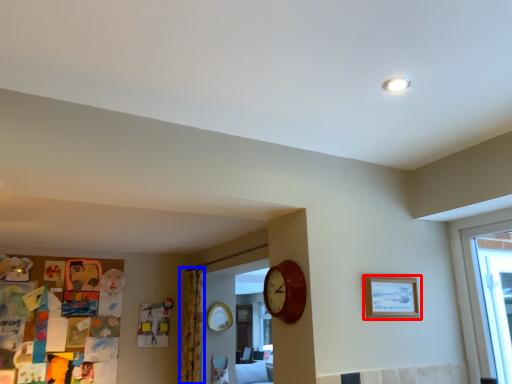
Question: Among these objects, which one is nearest to the camera, picture frame (highlighted by a red box) or curtain (highlighted by a blue box)?

Choices:
 (A) picture frame
 (B) curtain

Answer: (A)